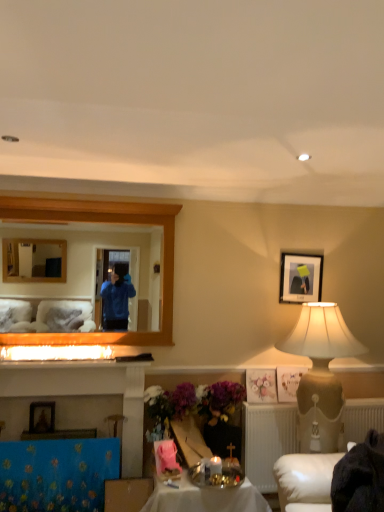
Question: Is beige textured lampshade at right positioned far away from pastel floral print at center?

Choices:
 (A) no
 (B) yes

Answer: (A)

Question: Is beige textured lampshade at right turned away from pastel floral print at center?

Choices:
 (A) yes
 (B) no

Answer: (B)

Question: Is beige textured lampshade at right oriented towards pastel floral print at center?

Choices:
 (A) yes
 (B) no

Answer: (B)

Question: From a real-world perspective, is beige textured lampshade at right on top of pastel floral print at center?

Choices:
 (A) no
 (B) yes

Answer: (A)

Question: Can you confirm if beige textured lampshade at right is wider than pastel floral print at center?

Choices:
 (A) no
 (B) yes

Answer: (B)

Question: Is white textured radiator at lower right inside or outside of pastel floral print at center?

Choices:
 (A) inside
 (B) outside

Answer: (B)

Question: From a real-world perspective, relative to pastel floral print at center, is white textured radiator at lower right vertically above or below?

Choices:
 (A) below
 (B) above

Answer: (A)

Question: Based on their sizes in the image, would you say white textured radiator at lower right is bigger or smaller than pastel floral print at center?

Choices:
 (A) big
 (B) small

Answer: (A)

Question: Is white textured radiator at lower right taller or shorter than pastel floral print at center?

Choices:
 (A) tall
 (B) short

Answer: (A)

Question: Considering the relative positions of wooden frame mirror at upper left and pastel floral print at center in the image provided, is wooden frame mirror at upper left to the left or to the right of pastel floral print at center?

Choices:
 (A) left
 (B) right

Answer: (A)

Question: Considering the positions of point (49, 250) and point (253, 380), is point (49, 250) closer or farther from the camera than point (253, 380)?

Choices:
 (A) farther
 (B) closer

Answer: (A)

Question: Would you say wooden frame mirror at upper left is inside or outside pastel floral print at center?

Choices:
 (A) inside
 (B) outside

Answer: (B)

Question: From a real-world perspective, is wooden frame mirror at upper left above or below pastel floral print at center?

Choices:
 (A) below
 (B) above

Answer: (B)

Question: Considering the positions of shiny metallic tray at center and wooden picture frame at lower left, the first picture frame when ordered from bottom to top, in the image, is shiny metallic tray at center wider or thinner than wooden picture frame at lower left, the first picture frame when ordered from bottom to top,?

Choices:
 (A) thin
 (B) wide

Answer: (B)

Question: In terms of size, does shiny metallic tray at center appear bigger or smaller than wooden picture frame at lower left, which is the 2th picture frame in back-to-front order?

Choices:
 (A) big
 (B) small

Answer: (A)